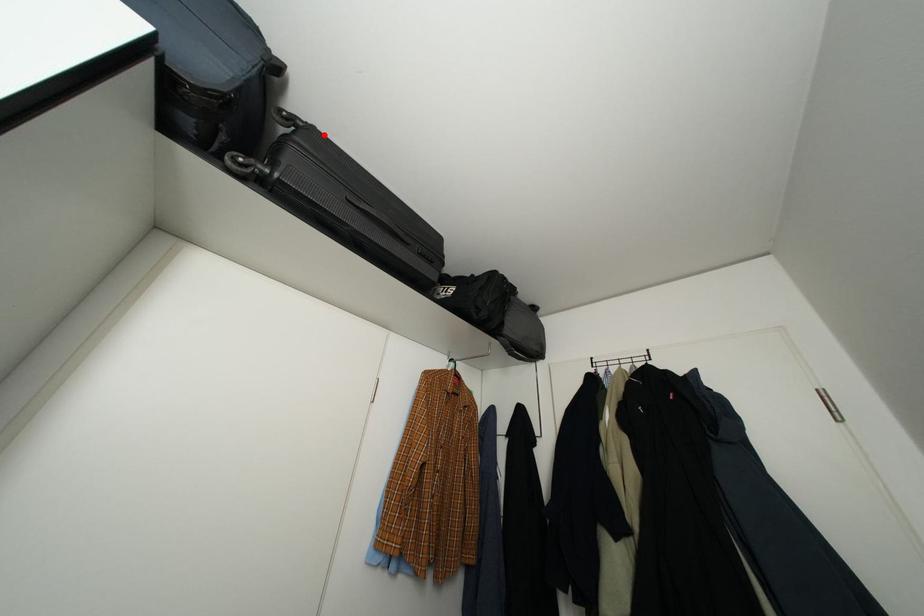
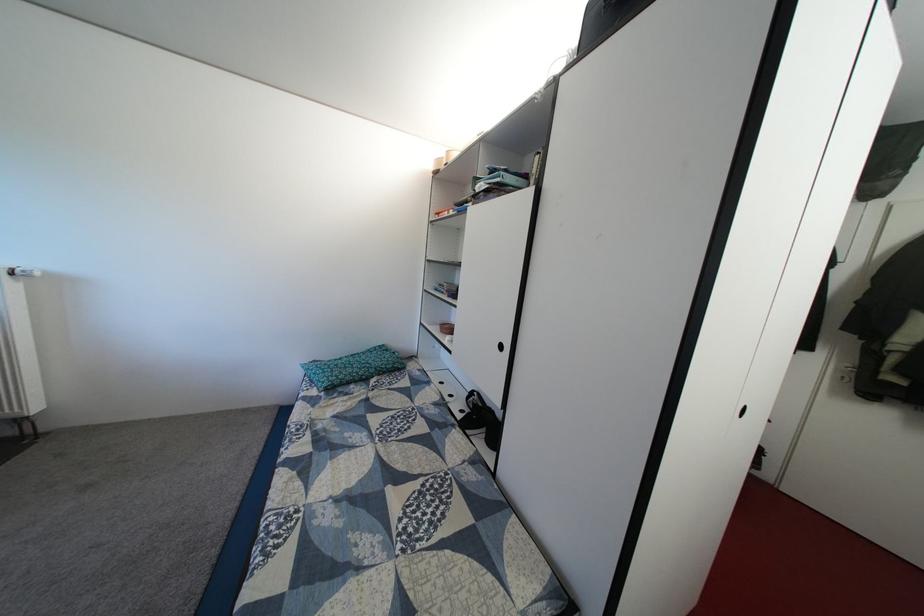
Question: I am providing you with two images of the same scene from different viewpoints. A red point is marked on the first image. At the location where the point appears in image 1, is it still visible in image 2?

Choices:
 (A) Yes
 (B) No

Answer: (B)